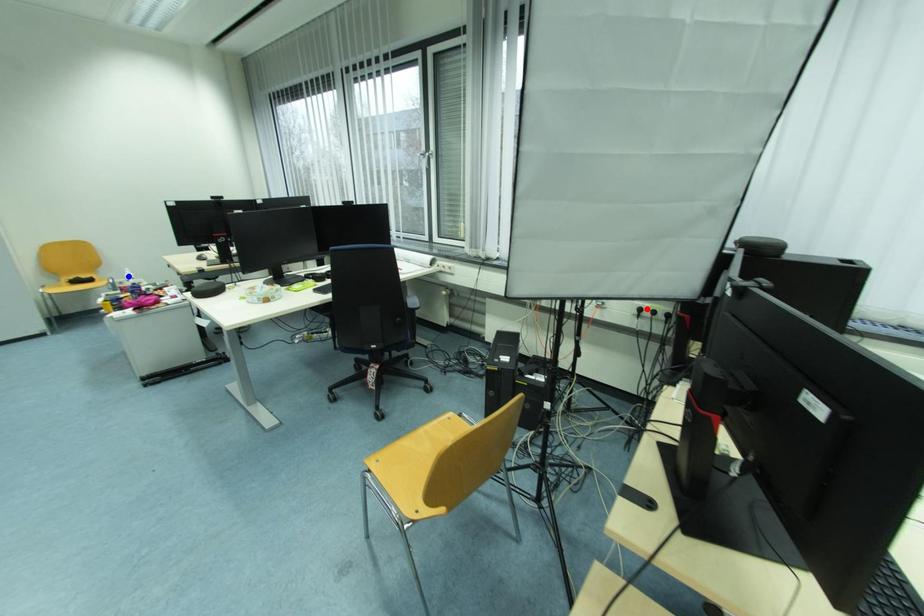
Question: Which of the two points in the image is closer to the camera?

Choices:
 (A) Blue point is closer.
 (B) Red point is closer.

Answer: (B)